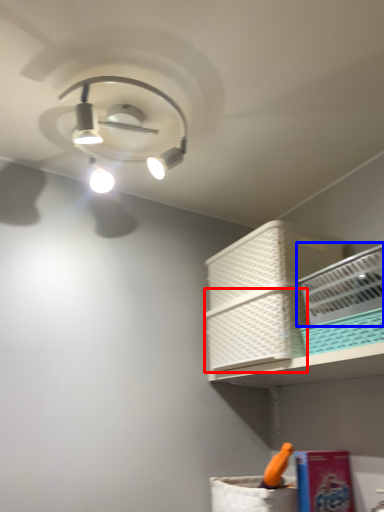
Question: Which object is closer to the camera taking this photo, basket (highlighted by a red box) or basket (highlighted by a blue box)?

Choices:
 (A) basket
 (B) basket

Answer: (B)